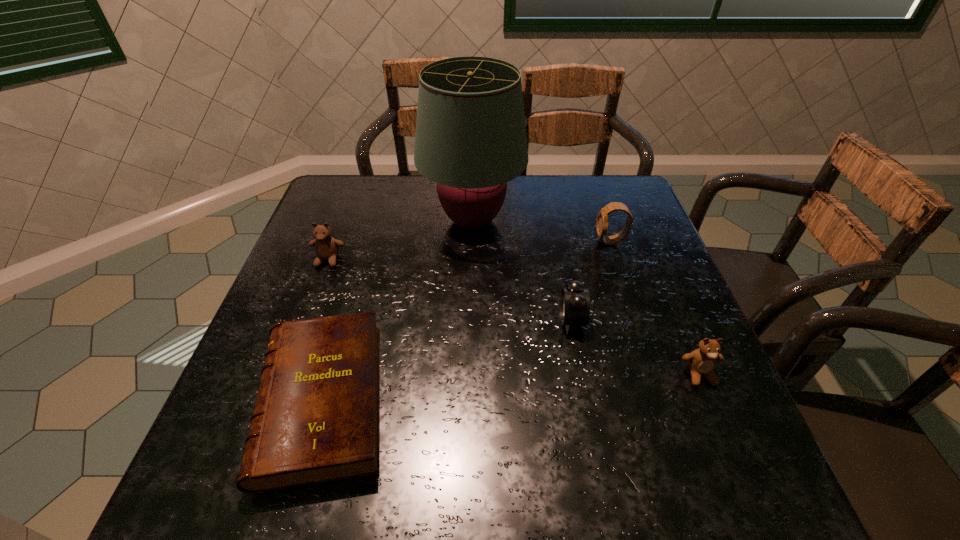
I want to click on teddy bear that is positioned at the left edge, so click(327, 247).

Where is `hardback book that is at the left edge`? This screenshot has height=540, width=960. hardback book that is at the left edge is located at coordinates (316, 417).

The image size is (960, 540). I want to click on watch that is at the right edge, so click(x=602, y=222).

I want to click on teddy bear located in the right edge section of the desktop, so [x=701, y=362].

Identify the location of object that is at the near left corner. (316, 417).

Locate an element on the screen. The image size is (960, 540). vacant area at the far edge of the desktop is located at coordinates (531, 207).

I want to click on vacant area at the near edge, so pos(510,485).

The image size is (960, 540). Identify the location of free space at the left edge of the desktop. (345, 227).

In the image, there is a desktop. Where is `vacant space at the right edge`? vacant space at the right edge is located at coordinates (679, 319).

Where is `vacant area at the far left corner of the desktop`? This screenshot has height=540, width=960. vacant area at the far left corner of the desktop is located at coordinates (344, 208).